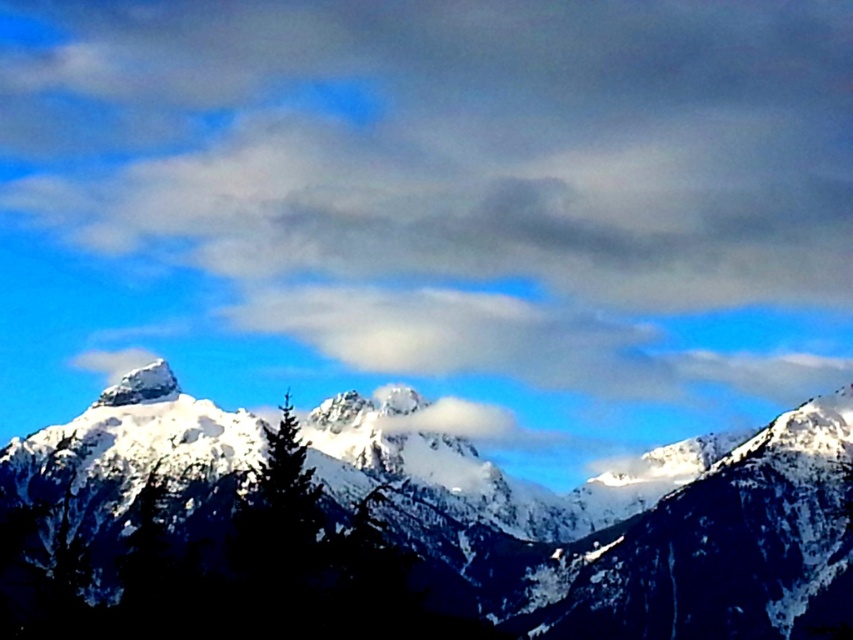
Question: Is white snow-covered mountain range at center in front of white snow-covered peak at upper center?

Choices:
 (A) yes
 (B) no

Answer: (A)

Question: Is white fluffy cloud at upper center smaller than white snow-covered mountain range at center?

Choices:
 (A) no
 (B) yes

Answer: (A)

Question: Does white fluffy cloud at upper center appear on the right side of white snow-covered peak at upper center?

Choices:
 (A) no
 (B) yes

Answer: (B)

Question: Which object is the farthest from the white snow-covered peak at upper center?

Choices:
 (A) white snow-covered mountain range at center
 (B) white fluffy cloud at upper center

Answer: (B)

Question: Which object is positioned closest to the white snow-covered peak at upper center?

Choices:
 (A) white fluffy cloud at upper center
 (B) white snow-covered mountain range at center

Answer: (B)

Question: Which object is the farthest from the white fluffy cloud at upper center?

Choices:
 (A) white snow-covered mountain range at center
 (B) white snow-covered peak at upper center

Answer: (B)